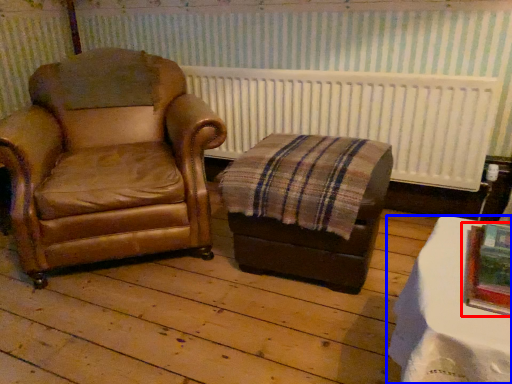
Question: Among these objects, which one is nearest to the camera, picture frame (highlighted by a red box) or table (highlighted by a blue box)?

Choices:
 (A) picture frame
 (B) table

Answer: (B)